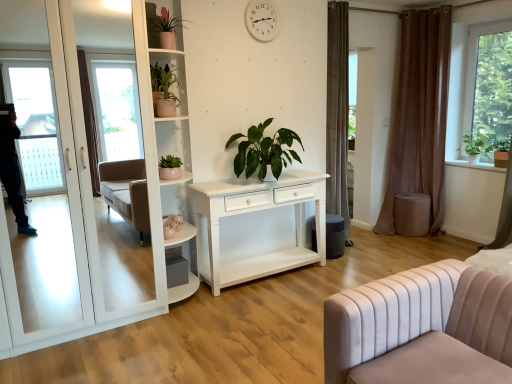
Question: Does point (248, 8) appear closer or farther from the camera than point (485, 147)?

Choices:
 (A) farther
 (B) closer

Answer: (B)

Question: From a real-world perspective, is white plastic clock at upper center positioned above or below green matte plant at upper right?

Choices:
 (A) below
 (B) above

Answer: (B)

Question: Considering the real-world distances, which object is farthest from the green matte plant at center, which is the fourth houseplant from left to right?

Choices:
 (A) green matte plant at upper left, positioned as the 4th houseplant in right-to-left order
 (B) green matte plant at center, the second houseplant positioned from the left
 (C) velvet beige studio couch at lower right
 (D) matte pink pot at upper left, placed as the second houseplant when sorted from right to left
 (E) velvet beige stool at right

Answer: (E)

Question: Considering the real-world distances, which object is farthest from the velvet beige studio couch at lower right?

Choices:
 (A) matte pink pot at upper left, which is the 3th houseplant in left-to-right order
 (B) velvet beige stool at right
 (C) green matte plant at upper right
 (D) white glossy bookshelf at upper left
 (E) brown velvet curtain at right

Answer: (C)